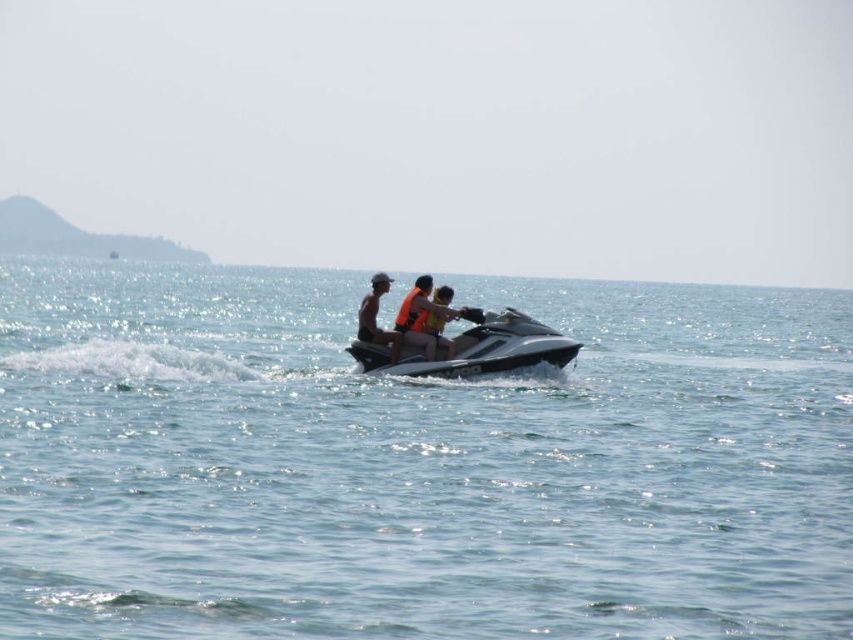
You are a lifeguard on duty and need to locate the matte orange life vest at center in the scene. According to the coordinates provided, where exactly is it positioned?

The matte orange life vest at center is located at coordinates point (409,317).

You are planning to take a group photo of the silver metallic jet ski at center and the tan skin person at center. The camera you are using has a maximum width capacity of 2 meters. Can you fit both subjects in the frame without cropping either of them?

The silver metallic jet ski at center might be wider than tan skin person at center. Therefore, it is uncertain whether both subjects can fit within the camera frame of 2 meters. Check the actual width of the jet ski and the person to confirm.